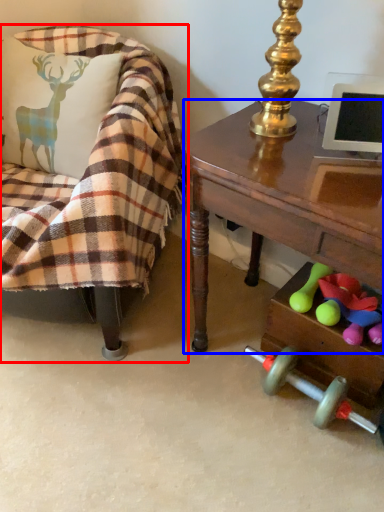
Question: Which object is further to the camera taking this photo, chair (highlighted by a red box) or desk (highlighted by a blue box)?

Choices:
 (A) chair
 (B) desk

Answer: (A)